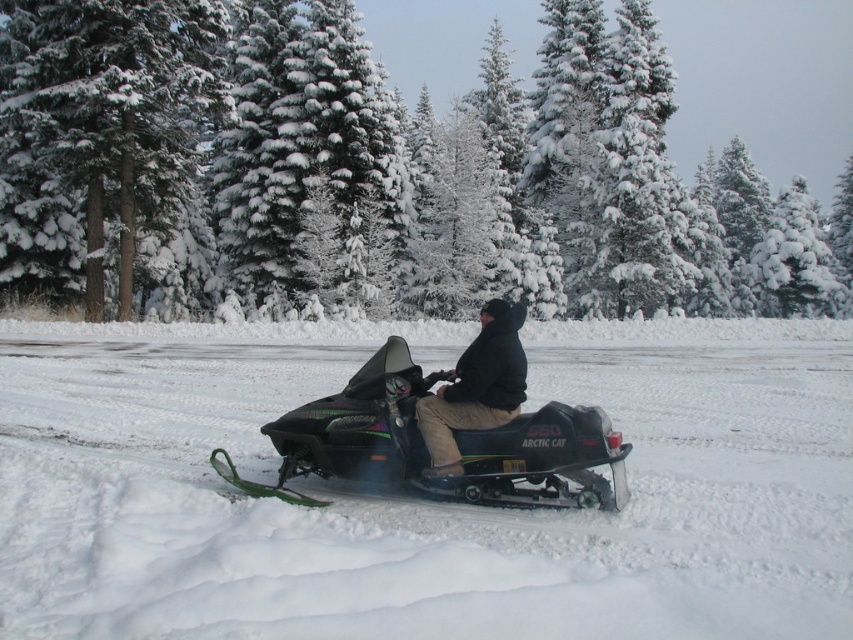
You are a snowmobile rider trying to navigate through the snowy terrain. You notice a specific point marked at coordinates point (416, 499). What is the terrain like at that exact point?

The terrain at point (416, 499) is white fluffy snow at center, which is suitable for the snowmobile to travel over.

From the picture: You are navigating a snowmobile through a snowy landscape and need to follow the path indicated by two points. The first point is at coordinates point (221, 580) and the second point is at point (506, 384). Which point should you head towards first to stay on the correct path?

You should head towards point (221, 580) first because it is in front of point (506, 384), so following that order keeps you on the correct path.